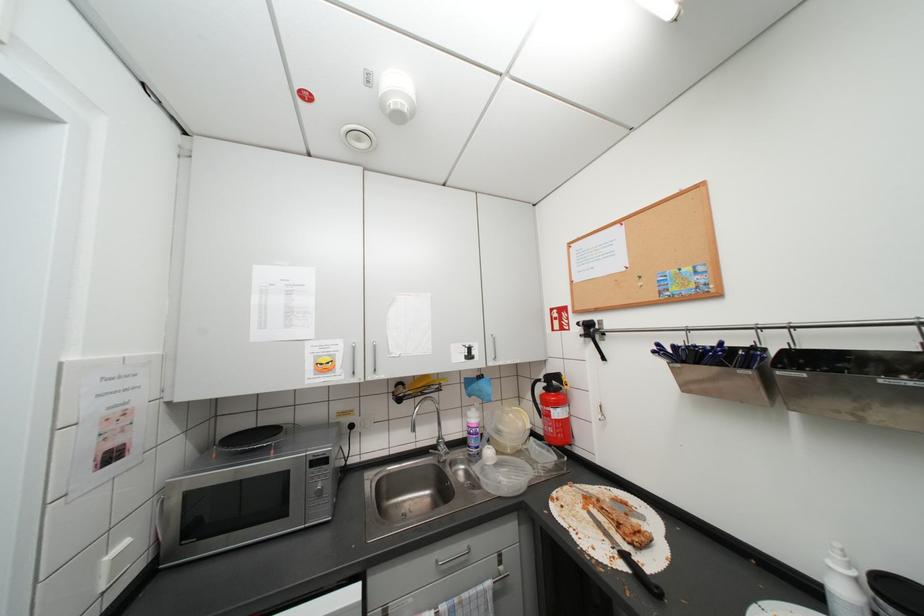
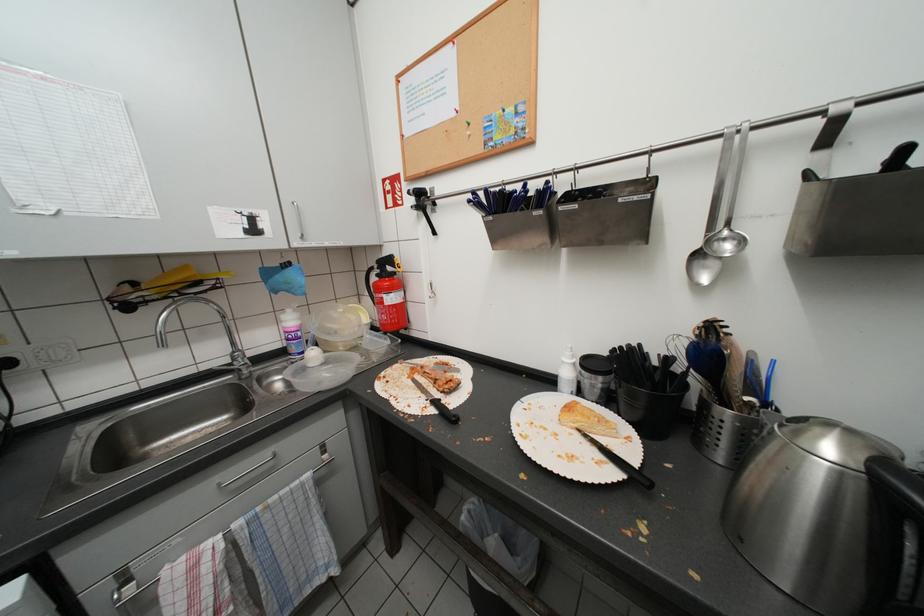
Based on the continuous images, in which direction is the camera rotating?

The camera rotated toward right-down.